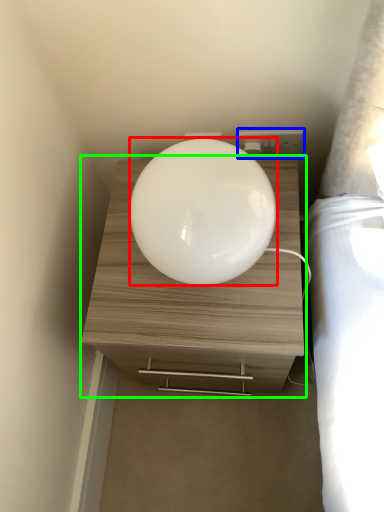
Question: Based on their relative distances, which object is farther from oval (highlighted by a red box)? Choose from electric outlet (highlighted by a blue box) and nightstand (highlighted by a green box).

Choices:
 (A) electric outlet
 (B) nightstand

Answer: (A)